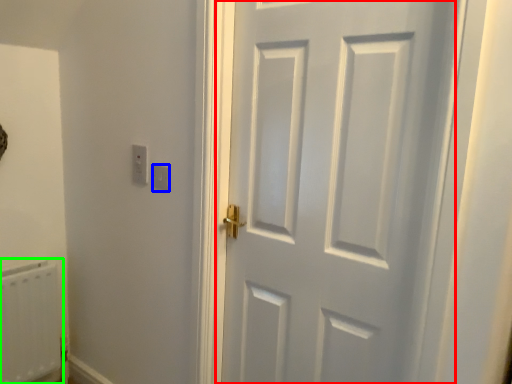
Question: Which is nearer to the door (highlighted by a red box)? light switch (highlighted by a blue box) or radiator (highlighted by a green box).

Choices:
 (A) light switch
 (B) radiator

Answer: (A)